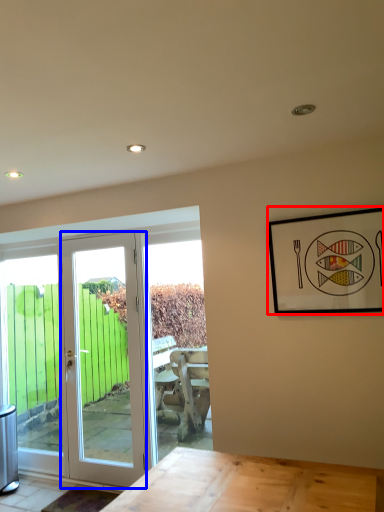
Question: Which point is further to the camera, picture frame (highlighted by a red box) or door (highlighted by a blue box)?

Choices:
 (A) picture frame
 (B) door

Answer: (B)